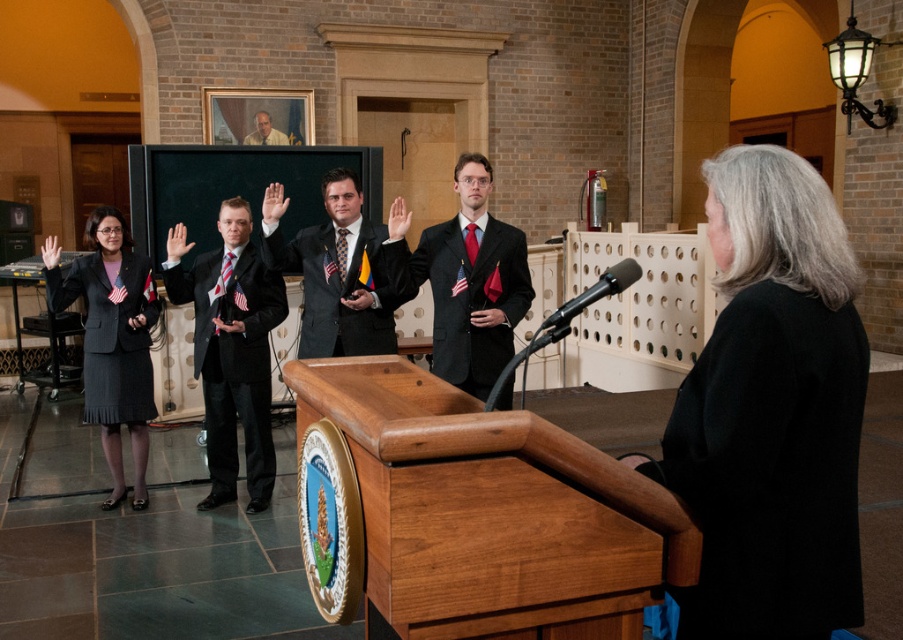
You are a photographer at the swearing ceremony. You need to focus your camera on both the point at coordinates point (805, 515) and point (193, 371). Which point should you focus on first to ensure the closer one is in sharp focus?

Point (805, 515) is closer to the camera than point (193, 371), so you should focus on point (805, 515) first to ensure it is in sharp focus.

You are a photographer positioned at the back of the room. You need to capture a photo that includes both the black wool business suit at center and the matte black suit at upper center. Given that your camera has a maximum focus range of 6 meters, will you be able to include both subjects in the same frame without moving closer?

The distance between the black wool business suit at center and the matte black suit at upper center is 7.12 meters. Since your camera can only focus up to 6 meters, you won cannot capture both subjects in the same frame without moving closer.